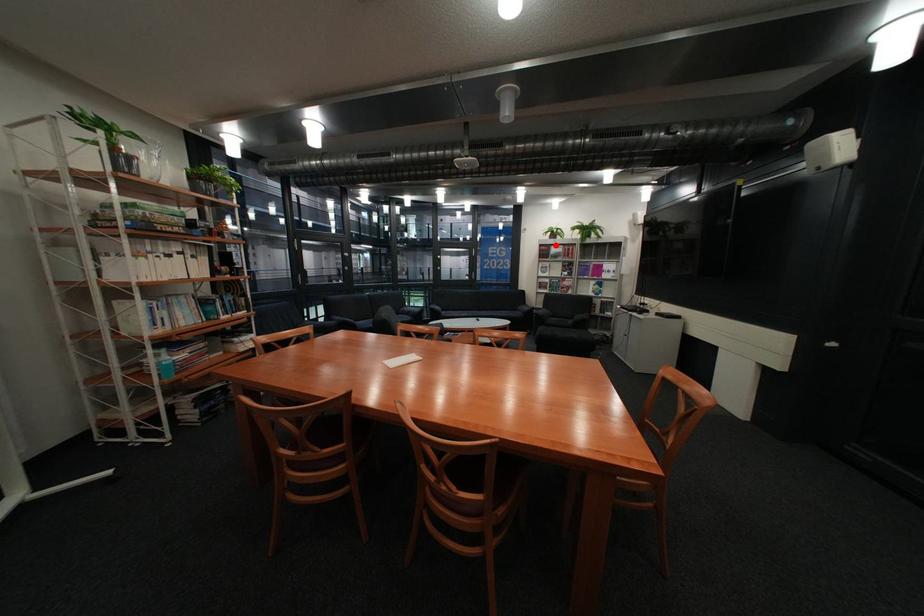
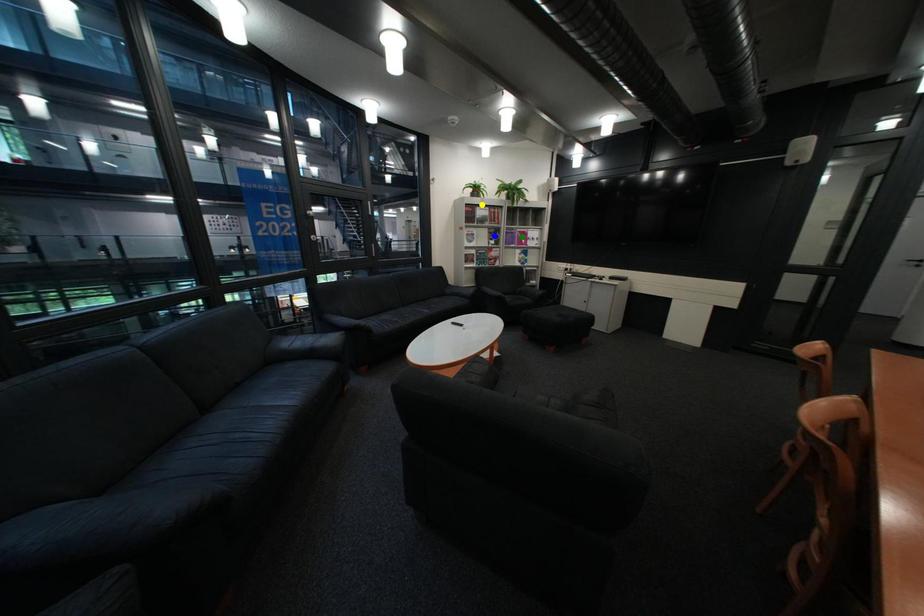
Question: I am providing you with two images of the same scene from different viewpoints. A red point is marked on the first image. You are given multiple points on the second image. Which mark in image 2 goes with the point in image 1?

Choices:
 (A) yellow point
 (B) blue point
 (C) green point

Answer: (A)